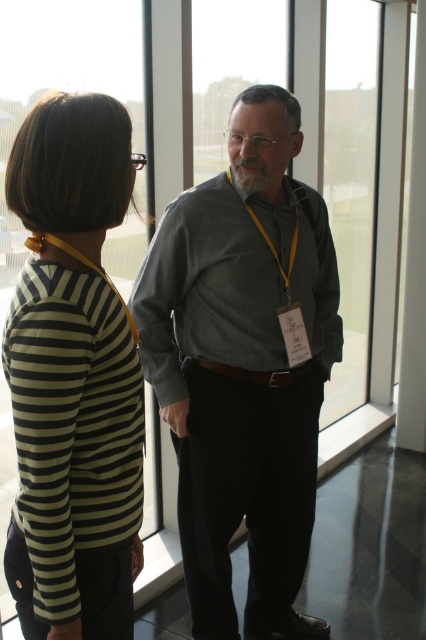
Which is below, gray matte shirt at center or gray cotton shirt at center?

gray matte shirt at center

Does point (317, 620) come behind point (245, 337)?

Yes, point (317, 620) is farther from viewer.

Is point (170, 253) farther from viewer compared to point (147, 300)?

No, it is not.

I want to click on gray matte shirt at center, so click(242, 365).

Measure the distance between point (80, 621) and camera.

A distance of 1.20 meters exists between point (80, 621) and camera.

Does striped fabric shirt at left appear under gray cotton shirt at center?

Yes, striped fabric shirt at left is below gray cotton shirt at center.

The image size is (426, 640). Find the location of `striped fabric shirt at left`. striped fabric shirt at left is located at coordinates (72, 378).

At what (x,y) coordinates should I click in order to perform the action: click on striped fabric shirt at left. Please return your answer as a coordinate pair (x, y). Image resolution: width=426 pixels, height=640 pixels. Looking at the image, I should click on (72, 378).

Locate an element on the screen. gray matte shirt at center is located at coordinates (242, 365).

What do you see at coordinates (242, 365) in the screenshot? I see `gray matte shirt at center` at bounding box center [242, 365].

You are a GUI agent. You are given a task and a screenshot of the screen. Output one action in this format:
    pyautogui.click(x=<x>, y=<y>)
    Task: Click on the gray matte shirt at center
    
    Given the screenshot: What is the action you would take?
    pyautogui.click(x=242, y=365)